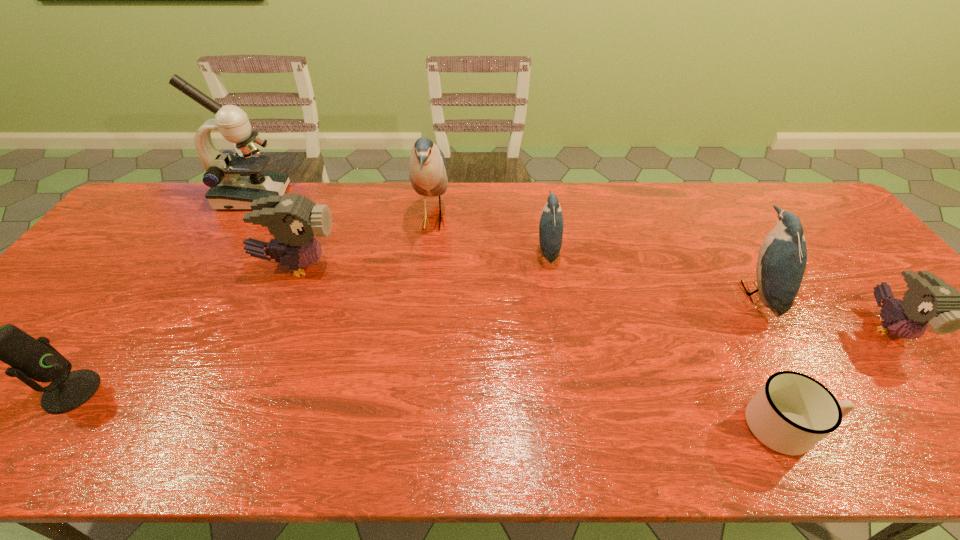
Where is `empty space that is in between the mug and the second smallest blue bird`? empty space that is in between the mug and the second smallest blue bird is located at coordinates (771, 360).

Identify the location of empty location between the right gray bird and the leftmost bird. (593, 297).

I want to click on free area in between the fourth object from right to left and the left gray bird, so (x=422, y=258).

Identify which object is located as the second nearest to the rightmost blue bird. Please provide its 2D coordinates. Your answer should be formatted as a tuple, i.e. [(x, y)], where the tuple contains the x and y coordinates of a point satisfying the conditions above.

[(929, 299)]

Select which object appears as the fourth closest to the farther gray bird. Please provide its 2D coordinates. Your answer should be formatted as a tuple, i.e. [(x, y)], where the tuple contains the x and y coordinates of a point satisfying the conditions above.

[(551, 225)]

Locate which bird is the third closest to the leftmost bird. Please provide its 2D coordinates. Your answer should be formatted as a tuple, i.e. [(x, y)], where the tuple contains the x and y coordinates of a point satisfying the conditions above.

[(782, 258)]

I want to click on bird that is the closest to the biggest blue bird, so click(x=293, y=220).

Find the location of a particular element. The width and height of the screenshot is (960, 540). the second closest blue bird to the smallest blue bird is located at coordinates (782, 258).

Locate an element on the screen. The height and width of the screenshot is (540, 960). blue bird that is the nearest to the smaller gray bird is located at coordinates (782, 258).

Where is `vacant space that satisfies the following two spatial constraints: 1. at the tip of the second blue bird from left to right's beak; 2. on the front side of the microphone`? The image size is (960, 540). vacant space that satisfies the following two spatial constraints: 1. at the tip of the second blue bird from left to right's beak; 2. on the front side of the microphone is located at coordinates (569, 392).